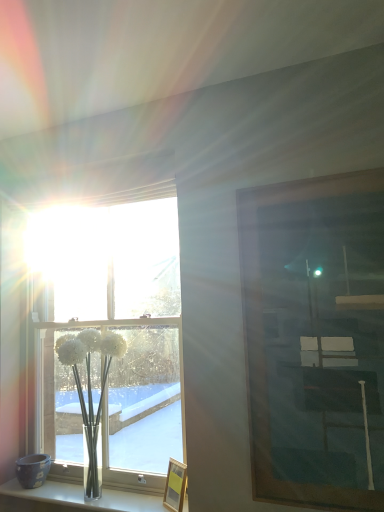
Question: From the image's perspective, is clear glass vase at lower left located above or below wooden picture frame at lower center, the 2th picture frame viewed from the front?

Choices:
 (A) below
 (B) above

Answer: (A)

Question: From a real-world perspective, is clear glass vase at lower left positioned above or below wooden picture frame at lower center, the first picture frame when ordered from left to right?

Choices:
 (A) below
 (B) above

Answer: (A)

Question: Estimate the real-world distances between objects in this image. Which object is closer to the wooden picture frame at lower center, which is the second picture frame in right-to-left order?

Choices:
 (A) white glass vase at lower left
 (B) clear glass vase at lower left
 (C) clear glass window at center
 (D) wooden picture frame at right, placed as the second picture frame when sorted from back to front

Answer: (B)

Question: Considering the real-world distances, which object is closest to the wooden picture frame at right, the 2th picture frame in the left-to-right sequence?

Choices:
 (A) white glass vase at lower left
 (B) wooden picture frame at lower center, placed as the 1th picture frame when sorted from back to front
 (C) clear glass window at center
 (D) clear glass vase at lower left

Answer: (B)